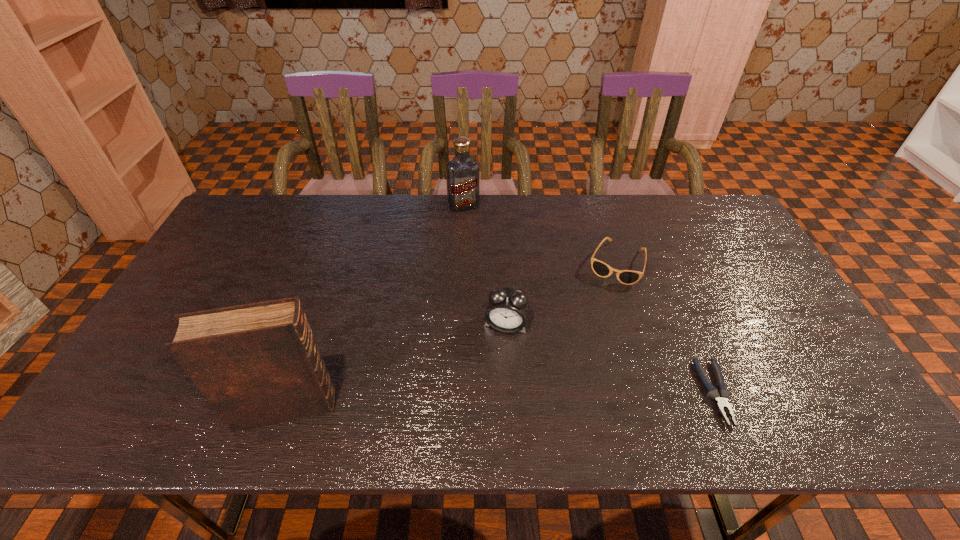
Locate an element on the screen. The height and width of the screenshot is (540, 960). free spot on the desktop that is between the tallest object and the shortest object and is positioned on the front-facing side of the second shortest object is located at coordinates (564, 398).

You are a GUI agent. You are given a task and a screenshot of the screen. Output one action in this format:
    pyautogui.click(x=<x>, y=<y>)
    Task: Click on the vacant space on the desktop that is between the Bible and the shortest object and is positioned on the front-facing side of the second tallest object
    The image size is (960, 540).
    Given the screenshot: What is the action you would take?
    pyautogui.click(x=530, y=399)

I want to click on vacant space on the desktop that is between the Bible and the rightmost object and is positioned on the front side of the third object from left to right, so click(x=492, y=401).